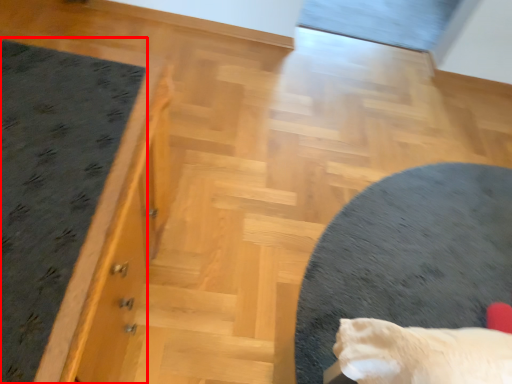
Question: Considering the relative positions of mat (annotated by the red box) and furniture in the image provided, where is mat (annotated by the red box) located with respect to the staircase?

Choices:
 (A) left
 (B) right

Answer: (A)